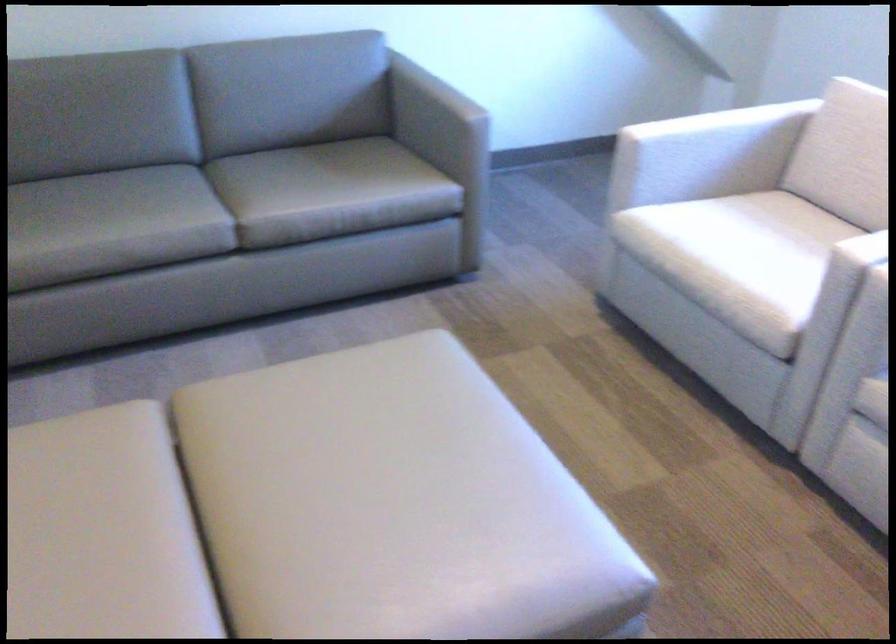
In order to click on gray sofa armrest in this screenshot , I will do `click(457, 104)`.